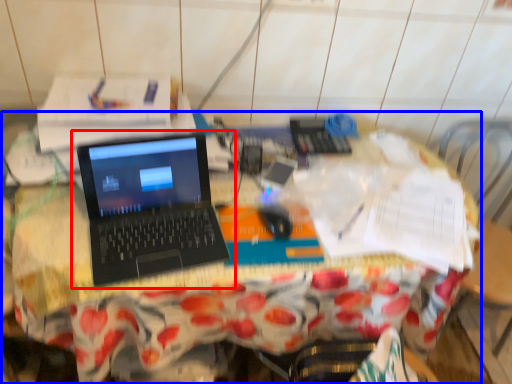
Question: Among these objects, which one is farthest to the camera, laptop (highlighted by a red box) or desk (highlighted by a blue box)?

Choices:
 (A) laptop
 (B) desk

Answer: (B)